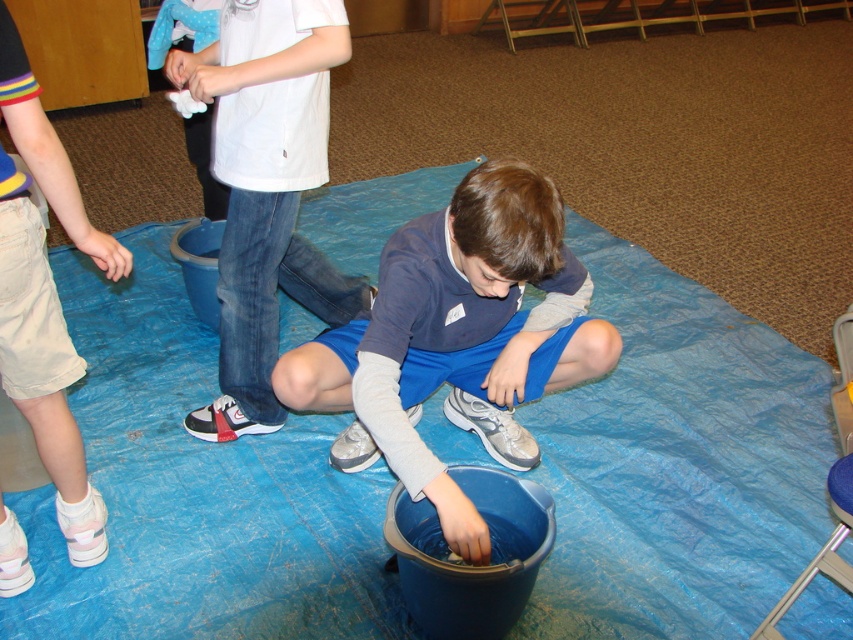
You are a teacher observing the children in the classroom. You notice a child wearing a white matte shirt at upper center and blue fabric shorts at center. Which piece of clothing is closer to the floor?

The blue fabric shorts at center is positioned under white matte shirt at upper center, so the blue fabric shorts at center is closer to the floor.

You are a teacher observing the children in the classroom. You notice two items on a child wearing blue fabric shorts at center and white matte shirt at upper center. Which item is shorter?

The blue fabric shorts at center is shorter than the white matte shirt at upper center.